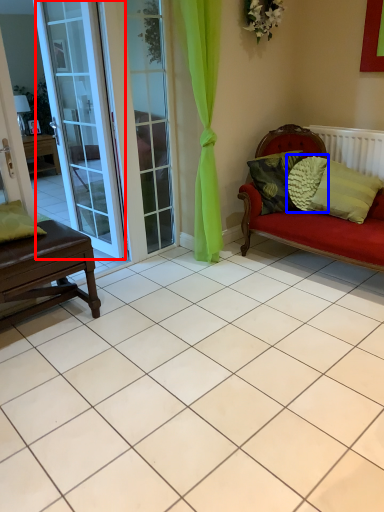
Question: Which object is closer to the camera taking this photo, door (highlighted by a red box) or pillow (highlighted by a blue box)?

Choices:
 (A) door
 (B) pillow

Answer: (A)